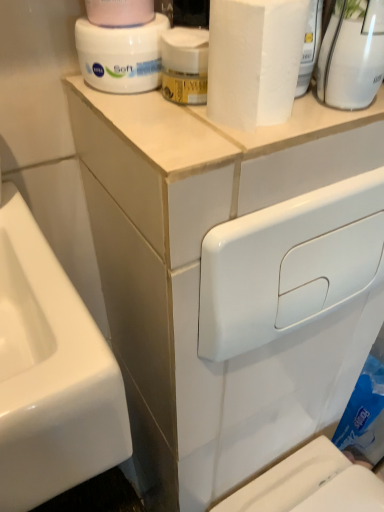
Question: Considering the positions of pink matte toilet paper at upper center and white glossy toilet tank at upper center in the image, is pink matte toilet paper at upper center wider or thinner than white glossy toilet tank at upper center?

Choices:
 (A) thin
 (B) wide

Answer: (B)

Question: Do you think pink matte toilet paper at upper center is within white glossy toilet tank at upper center, or outside of it?

Choices:
 (A) inside
 (B) outside

Answer: (B)

Question: Estimate the real-world distances between objects in this image. Which object is farther from the pink matte toilet paper at upper center?

Choices:
 (A) white matte paper towel at upper center
 (B) white glossy vase at upper right, the 2th cleaning product viewed from the left
 (C) white glossy toilet tank at upper center
 (D) white matte jar at upper center, marked as the first cleaning product in a left-to-right arrangement

Answer: (C)

Question: Which object is positioned closest to the white matte paper towel at upper center?

Choices:
 (A) white glossy toilet tank at upper center
 (B) white matte jar at upper center, which ranks as the second cleaning product in right-to-left order
 (C) white glossy vase at upper right, the 2th cleaning product viewed from the left
 (D) pink matte toilet paper at upper center

Answer: (C)